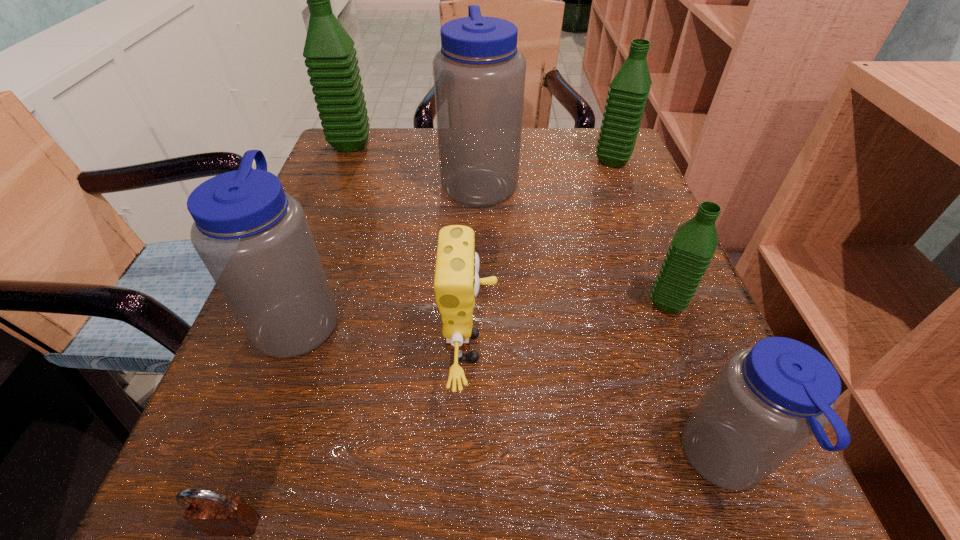
Where is `the biggest green water bottle`? Image resolution: width=960 pixels, height=540 pixels. the biggest green water bottle is located at coordinates (330, 55).

Locate an element on the screen. The image size is (960, 540). the third water bottle from left to right is located at coordinates (479, 74).

Find the location of `the second blue water bottle from left to right`. the second blue water bottle from left to right is located at coordinates (479, 74).

You are a GUI agent. You are given a task and a screenshot of the screen. Output one action in this format:
    pyautogui.click(x=<x>, y=<y>)
    Task: Click on the second biggest green water bottle
    
    Given the screenshot: What is the action you would take?
    pyautogui.click(x=628, y=93)

This screenshot has width=960, height=540. What are the coordinates of `the second nearest blue water bottle` in the screenshot? It's located at (254, 239).

What are the coordinates of `the leftmost blue water bottle` in the screenshot? It's located at (254, 239).

Image resolution: width=960 pixels, height=540 pixels. In order to click on sponge in this screenshot , I will do `click(456, 282)`.

Identify the location of the nearest green water bottle. The height and width of the screenshot is (540, 960). (693, 246).

Find the location of `the nearest blue water bottle`. the nearest blue water bottle is located at coordinates pos(770,400).

The image size is (960, 540). I want to click on the smallest blue water bottle, so click(770, 400).